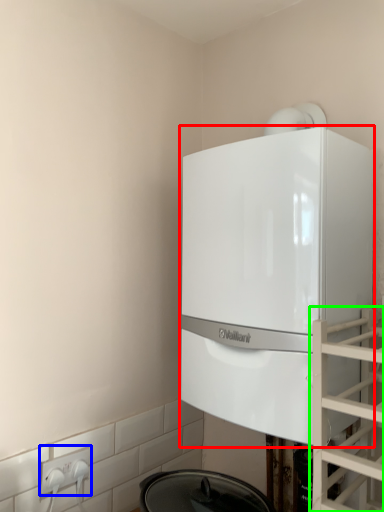
Question: Which object is the farthest from home appliance (highlighted by a red box)? Choose among these: electric outlet (highlighted by a blue box) or glass door (highlighted by a green box).

Choices:
 (A) electric outlet
 (B) glass door

Answer: (A)